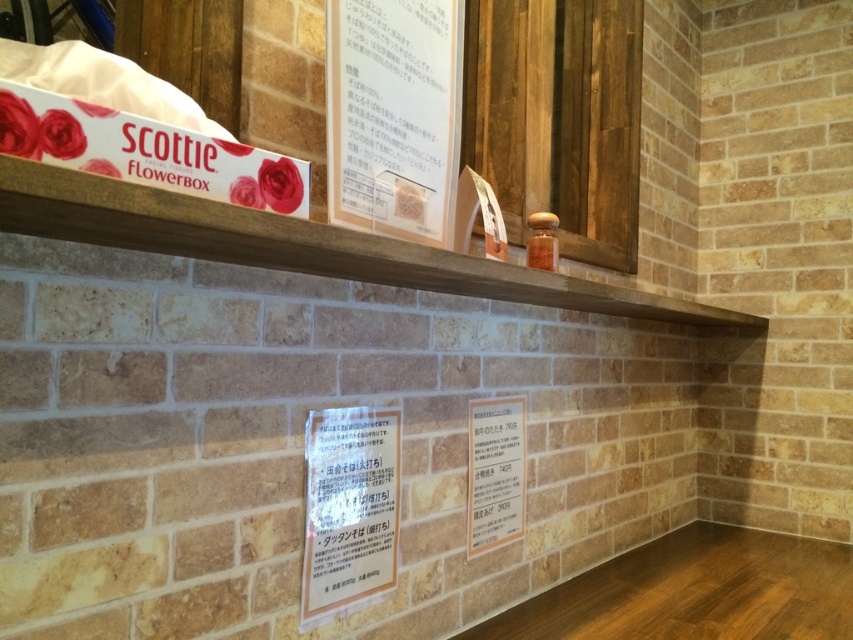
Question: Which point is closer to the camera?

Choices:
 (A) (521, 513)
 (B) (421, 282)
 (C) (364, 504)
 (D) (378, 138)

Answer: (D)

Question: Does white paper at upper center appear over white paper sign at center?

Choices:
 (A) no
 (B) yes

Answer: (B)

Question: Which of these objects is positioned closest to the white paper sign at center?

Choices:
 (A) matte paper sign at center
 (B) wooden shelf at upper center
 (C) white paper at upper center

Answer: (A)

Question: Which point is farther from the camera taking this photo?

Choices:
 (A) (383, 272)
 (B) (474, 419)
 (C) (373, 76)

Answer: (B)

Question: Can you confirm if wooden shelf at upper center is positioned below white paper at upper center?

Choices:
 (A) yes
 (B) no

Answer: (A)

Question: Is wooden shelf at upper center behind matte paper sign at center?

Choices:
 (A) yes
 (B) no

Answer: (B)